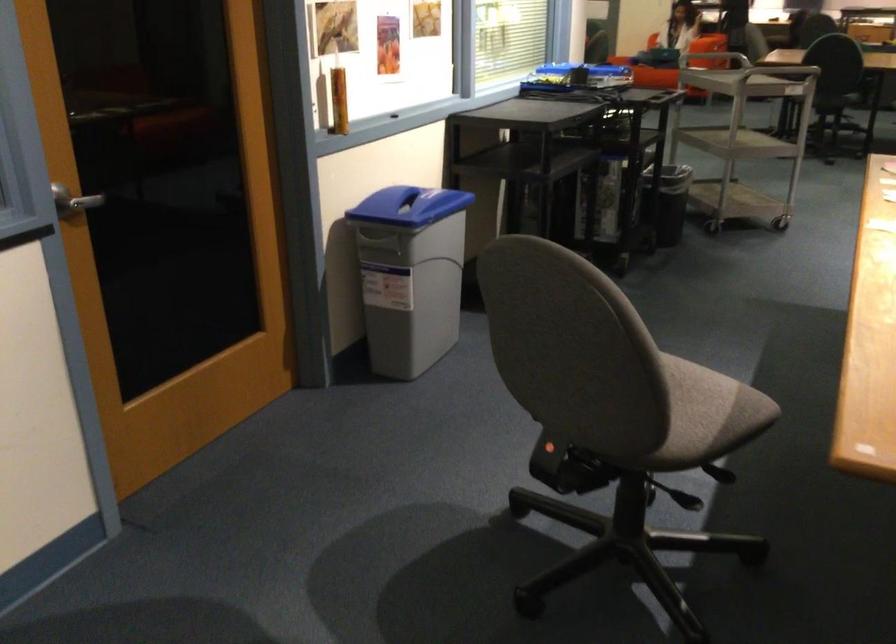
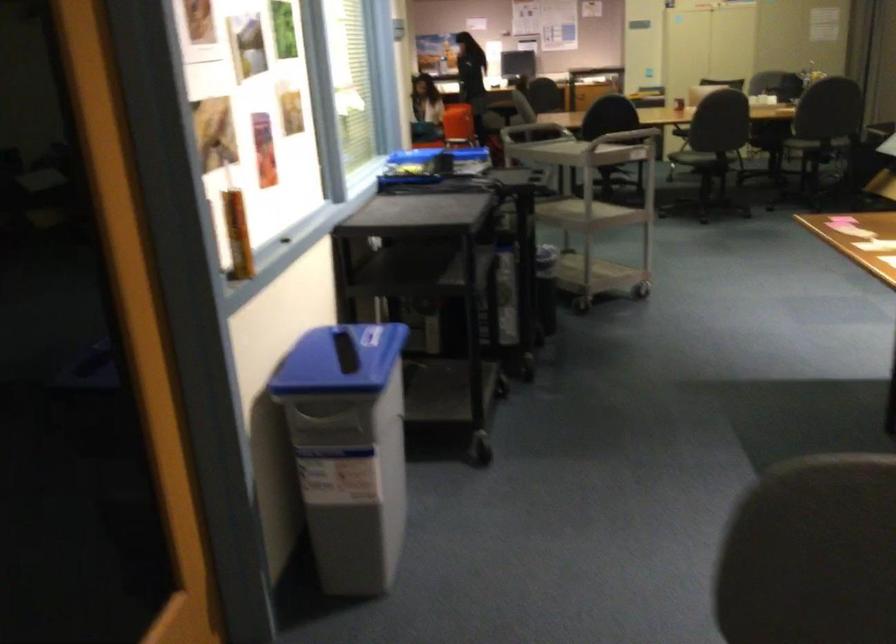
Looking at this image, which direction would the cameraman need to move to produce the second image?

The cameraman moved toward left, forward.